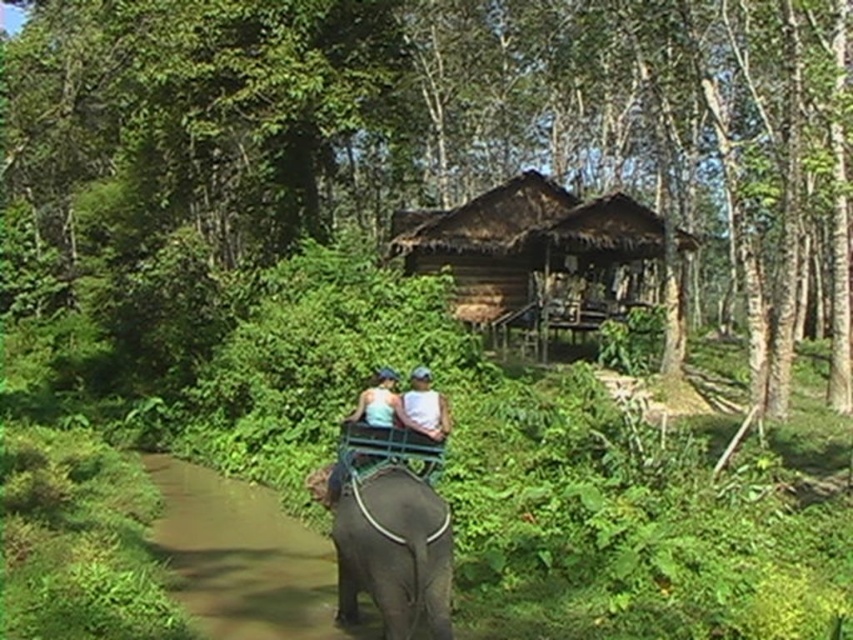
Who is more forward, (225,230) or (459,296)?

Point (459,296)

Between green leafy tree at center and brown thatch hut at center, which one appears on the right side from the viewer's perspective?

Positioned to the right is green leafy tree at center.

Between point (326, 44) and point (518, 220), which one is positioned in front?

Point (326, 44) is more forward.

At what (x,y) coordinates should I click in order to perform the action: click on green leafy tree at center. Please return your answer as a coordinate pair (x, y). Looking at the image, I should click on (448, 157).

Is gray matte elephant at lower center positioned at the back of white matte shirt at center?

No.

Looking at this image, who is more distant from viewer, (434, 547) or (430, 381)?

Point (430, 381)

Identify the location of gray matte elephant at lower center. (393, 554).

Between point (364, 218) and point (424, 380), which one is positioned in front?

Point (424, 380)

Between green leafy tree at center and white matte shirt at center, which one is positioned lower?

white matte shirt at center is lower down.

This screenshot has width=853, height=640. I want to click on green leafy tree at center, so click(448, 157).